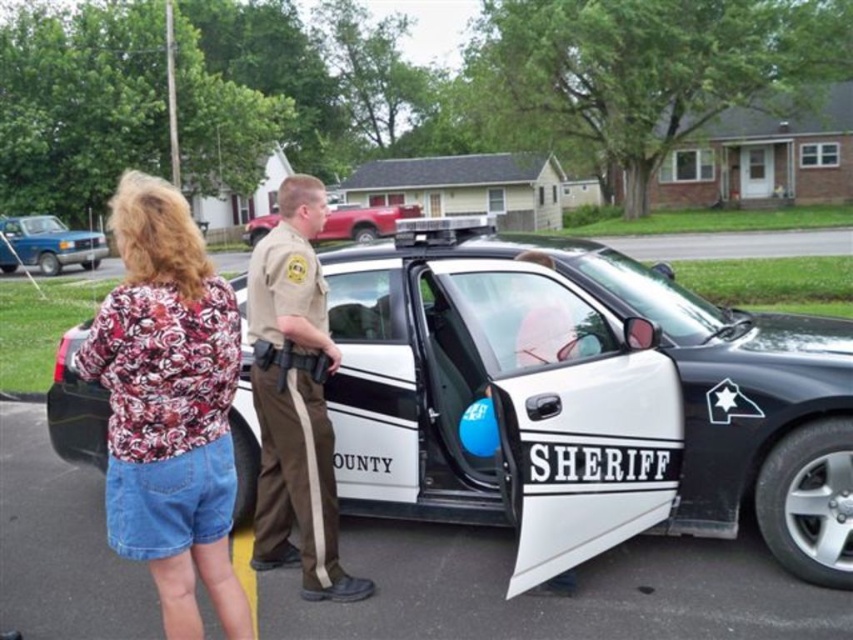
Is floral fabric blouse at upper left wider than matte blue truck at left?

Correct, the width of floral fabric blouse at upper left exceeds that of matte blue truck at left.

Is floral fabric blouse at upper left above matte blue truck at left?

Yes.

Is point (215, 326) positioned before point (84, 248)?

Yes.

You are a GUI agent. You are given a task and a screenshot of the screen. Output one action in this format:
    pyautogui.click(x=<x>, y=<y>)
    Task: Click on the floral fabric blouse at upper left
    
    Given the screenshot: What is the action you would take?
    pyautogui.click(x=169, y=406)

This screenshot has width=853, height=640. Describe the element at coordinates (169, 406) in the screenshot. I see `floral fabric blouse at upper left` at that location.

Is floral fabric blouse at upper left above tan uniform at center?

Indeed, floral fabric blouse at upper left is positioned over tan uniform at center.

Locate an element on the screen. This screenshot has width=853, height=640. floral fabric blouse at upper left is located at coordinates (169, 406).

In order to click on floral fabric blouse at upper left in this screenshot , I will do `click(169, 406)`.

Is white glossy sheriff car at center positioned at the back of tan uniform at center?

That is False.

Looking at this image, which is more to the right, white glossy sheriff car at center or tan uniform at center?

Positioned to the right is white glossy sheriff car at center.

You are a GUI agent. You are given a task and a screenshot of the screen. Output one action in this format:
    pyautogui.click(x=<x>, y=<y>)
    Task: Click on the white glossy sheriff car at center
    
    Given the screenshot: What is the action you would take?
    pyautogui.click(x=579, y=364)

The image size is (853, 640). What are the coordinates of `white glossy sheriff car at center` in the screenshot? It's located at (579, 364).